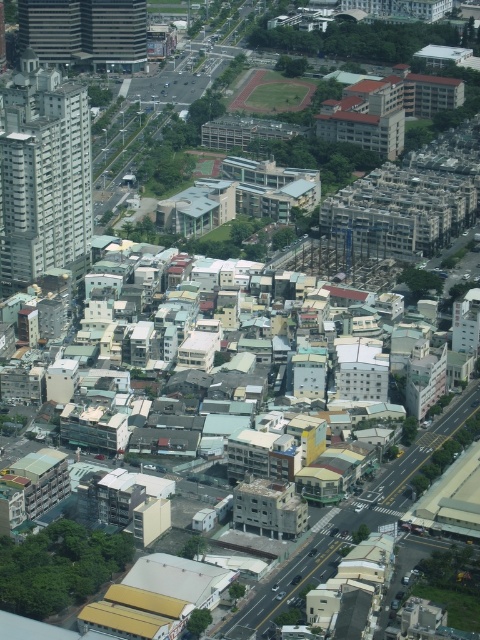
You are a drone operator trying to capture aerial shots of the urban area. You have two points marked on your map, point 1 at coordinates point (57, 106) and point 2 at coordinates point (98, 60). Which point is closer to your current position as the drone flies over the area?

Point (57, 106) is closer to the viewer than point (98, 60), so the drone is closer to point (57, 106).

You are a delivery drone that needs to fly from the gray concrete building at left to the matte glass skyscraper at upper left. The minimum safe distance between your drone and any building is 50 meters. Can you safely make this flight without violating the safety rule?

The gray concrete building at left and matte glass skyscraper at upper left are 81.00 meters apart from each other. Since the minimum safe distance is 50 meters, the drone can safely fly between them as the distance between the buildings is greater than the required safety margin.

You are a drone operator trying to deliver a package to the gray concrete building at left. Your drone has a maximum range of 500 meters. Can you safely deliver the package without exceeding the drone delivery range?

The gray concrete building at left is 583.41 meters away from the viewer, which exceeds the drone delivery range of 500 meters. Therefore, the drone cannot safely deliver the package without exceeding its maximum range.